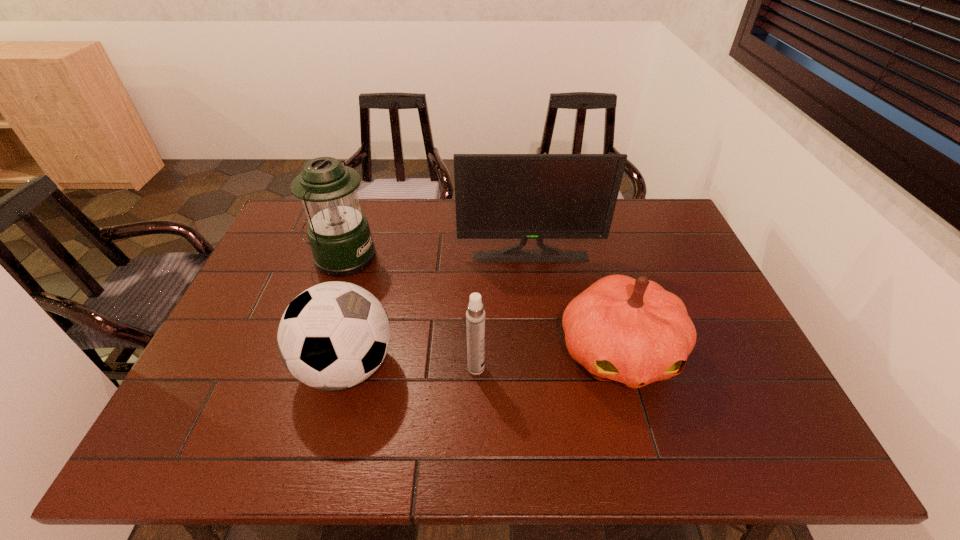
Locate an element on the screen. vacant area that lies between the aerosol can and the lantern is located at coordinates (410, 313).

I want to click on free area in between the aerosol can and the pumpkin, so click(547, 360).

You are a GUI agent. You are given a task and a screenshot of the screen. Output one action in this format:
    pyautogui.click(x=<x>, y=<y>)
    Task: Click on the vacant space that is in between the monitor and the lantern
    The image size is (960, 540).
    Given the screenshot: What is the action you would take?
    pyautogui.click(x=437, y=257)

Find the location of `free space between the soccer ball and the aerosol can`. free space between the soccer ball and the aerosol can is located at coordinates (412, 368).

The width and height of the screenshot is (960, 540). I want to click on blank region between the monitor and the soccer ball, so click(439, 312).

The image size is (960, 540). Find the location of `free space between the aerosol can and the lantern`. free space between the aerosol can and the lantern is located at coordinates click(410, 313).

Image resolution: width=960 pixels, height=540 pixels. In order to click on free space between the monitor and the aerosol can in this screenshot , I will do `click(503, 312)`.

Select which object appears as the closest to the lantern. Please provide its 2D coordinates. Your answer should be formatted as a tuple, i.e. [(x, y)], where the tuple contains the x and y coordinates of a point satisfying the conditions above.

[(334, 335)]

At what (x,y) coordinates should I click in order to perform the action: click on object that ranks as the closest to the soccer ball. Please return your answer as a coordinate pair (x, y). The image size is (960, 540). Looking at the image, I should click on (475, 315).

Where is `vacant space that satisfies the following two spatial constraints: 1. on the main logo of the soccer ball; 2. on the left side of the aerosol can`? Image resolution: width=960 pixels, height=540 pixels. vacant space that satisfies the following two spatial constraints: 1. on the main logo of the soccer ball; 2. on the left side of the aerosol can is located at coordinates (347, 368).